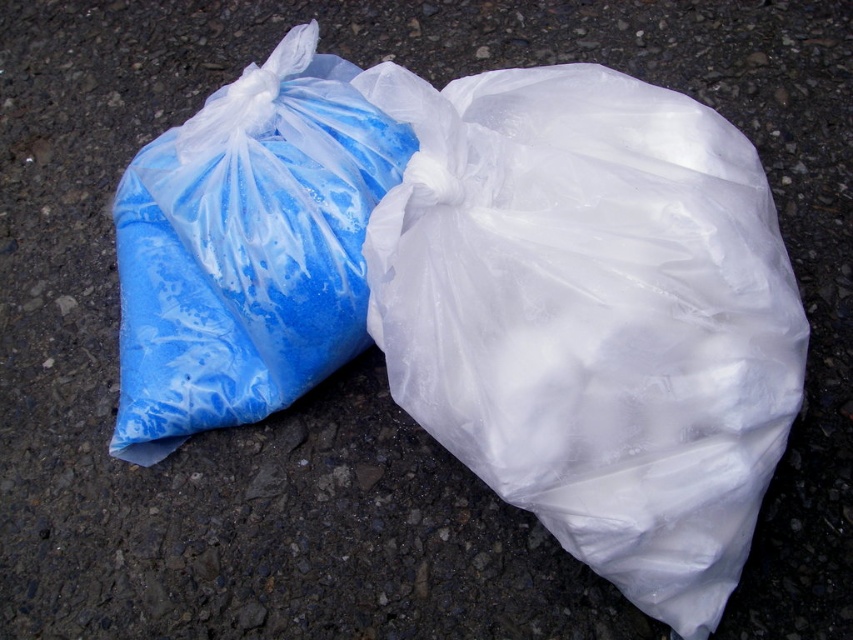
Question: Which object is farther from the camera taking this photo?

Choices:
 (A) transparent plastic bag at center
 (B) blue matte plastic bag at left

Answer: (B)

Question: Which point is farther to the camera?

Choices:
 (A) blue matte plastic bag at left
 (B) transparent plastic bag at center

Answer: (A)

Question: Does transparent plastic bag at center have a larger size compared to blue matte plastic bag at left?

Choices:
 (A) no
 (B) yes

Answer: (B)

Question: Is transparent plastic bag at center to the right of blue matte plastic bag at left from the viewer's perspective?

Choices:
 (A) yes
 (B) no

Answer: (A)

Question: Which point is farther to the camera?

Choices:
 (A) blue matte plastic bag at left
 (B) transparent plastic bag at center

Answer: (A)

Question: In this image, where is transparent plastic bag at center located relative to blue matte plastic bag at left?

Choices:
 (A) above
 (B) below

Answer: (B)